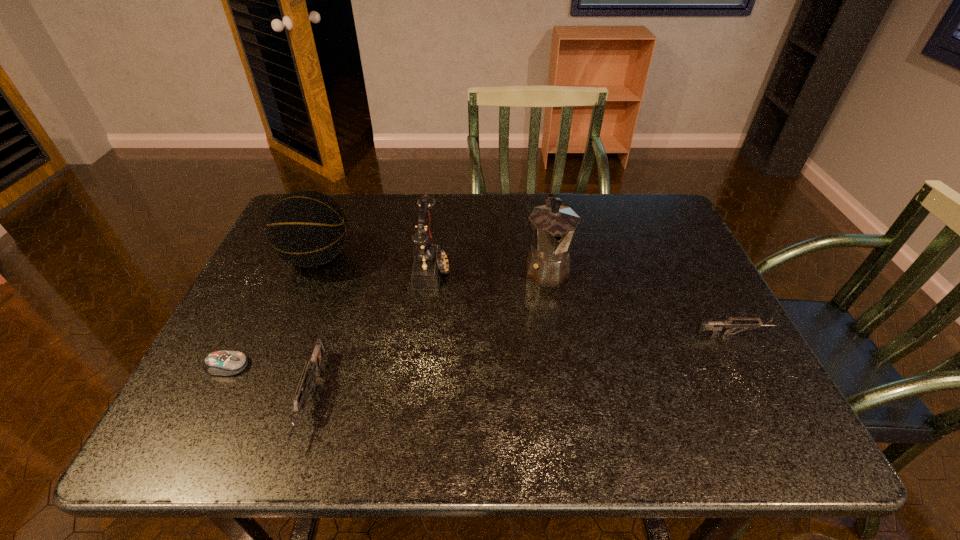
Locate an element on the screen. free location located on the dial of the telephone is located at coordinates (509, 268).

Find the location of a particular element. free space located on the wheel side of the shortest object is located at coordinates coord(350,366).

I want to click on object that is at the far edge, so click(x=305, y=228).

Locate an element on the screen. This screenshot has height=540, width=960. gun that is at the near edge is located at coordinates (313, 366).

Where is `computer mouse located at the near edge`? This screenshot has height=540, width=960. computer mouse located at the near edge is located at coordinates (221, 363).

Find the location of a particular element. Image resolution: width=960 pixels, height=540 pixels. basketball present at the left edge is located at coordinates (305, 228).

Identify the location of computer mouse at the left edge. (221, 363).

Identify the location of object at the right edge. (716, 327).

Image resolution: width=960 pixels, height=540 pixels. Find the location of `object situated at the far left corner`. object situated at the far left corner is located at coordinates (305, 228).

At what (x,y) coordinates should I click in order to perform the action: click on object present at the near left corner. Please return your answer as a coordinate pair (x, y). The image size is (960, 540). Looking at the image, I should click on (221, 363).